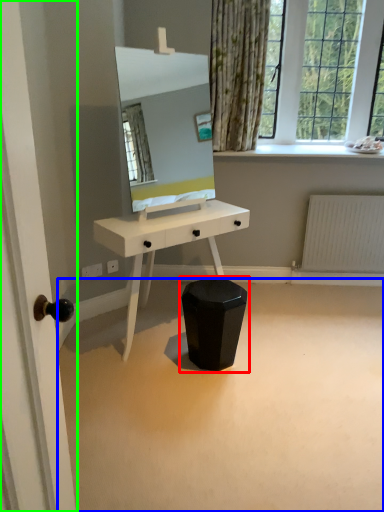
Question: Which object is the farthest from swivel chair (highlighted by a red box)? Choose among these: plain (highlighted by a blue box) or door (highlighted by a green box).

Choices:
 (A) plain
 (B) door

Answer: (B)